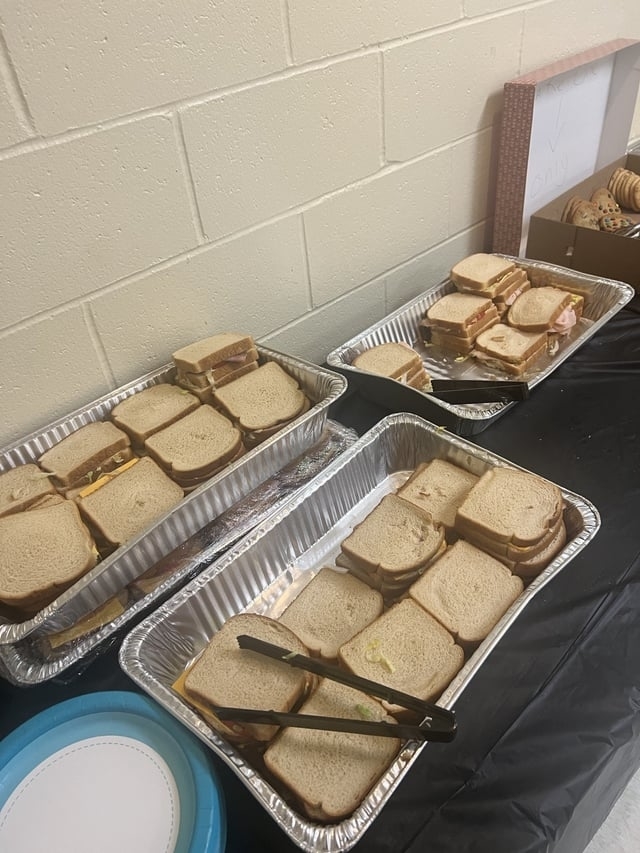
I want to click on tin tray, so click(x=289, y=560), click(x=201, y=498), click(x=476, y=415).